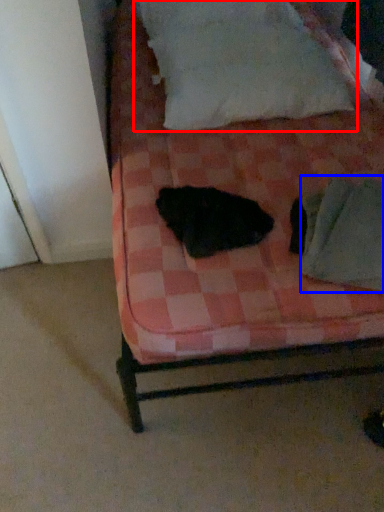
Question: Which object is further to the camera taking this photo, pillow (highlighted by a red box) or linen (highlighted by a blue box)?

Choices:
 (A) pillow
 (B) linen

Answer: (A)